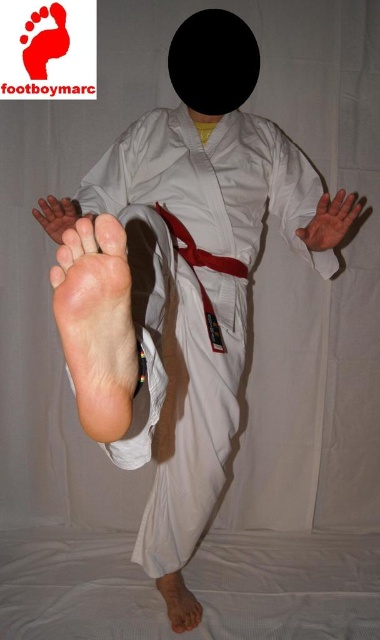
You are a martial arts instructor observing a student practicing a stance. The student is wearing a white cotton kimono at center and has pinkish matte skin at lower center. If you need to adjust the distance between these two parts to be closer by 15 centimeters, what should you advise the student to do?

The white cotton kimono at center and pinkish matte skin at lower center are currently 81.25 centimeters apart. To reduce the distance by 15 centimeters, the student should move the pinkish matte skin at lower center closer to the white cotton kimono at center by 15 centimeters.

You are a martial arts instructor observing a student practicing a stance. You notice two distinct areas of skin tone on the student. The first is the pale skin foot at center, and the second is the pinkish matte skin at lower center. Which of these two areas is positioned to the left when viewed from the front?

The pale skin foot at center is positioned to the left of the pinkish matte skin at lower center.